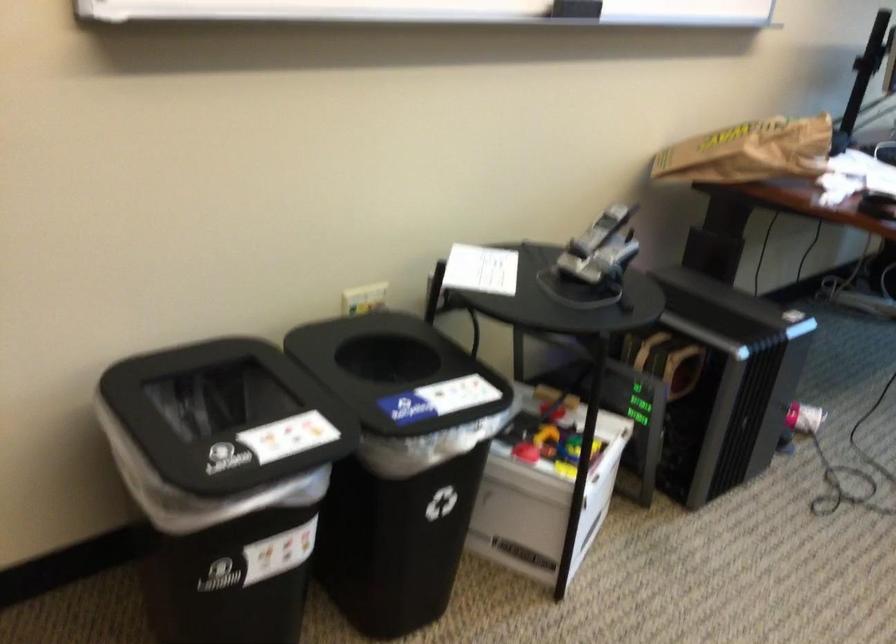
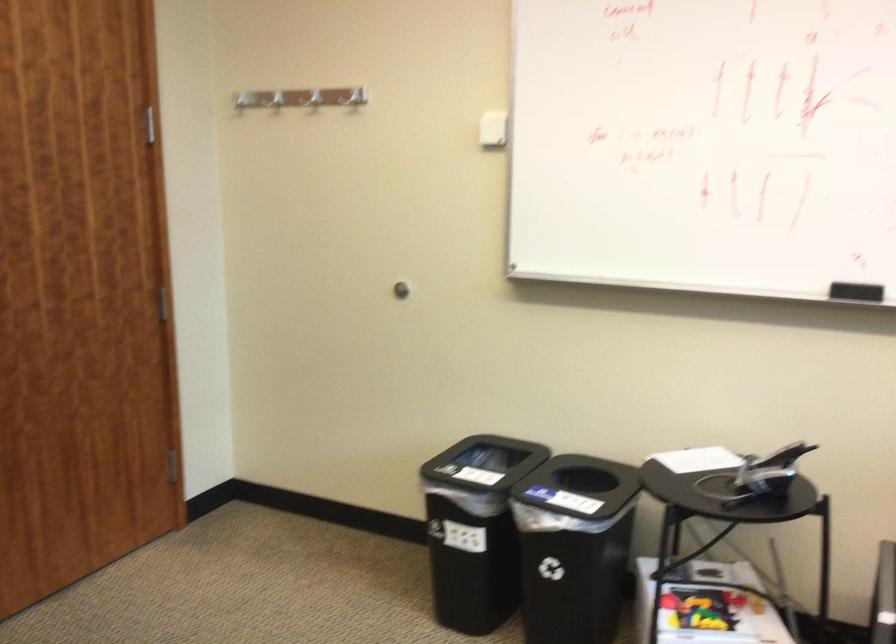
In the second image, find the point that corresponds to pixel 299 527 in the first image.

(475, 529)